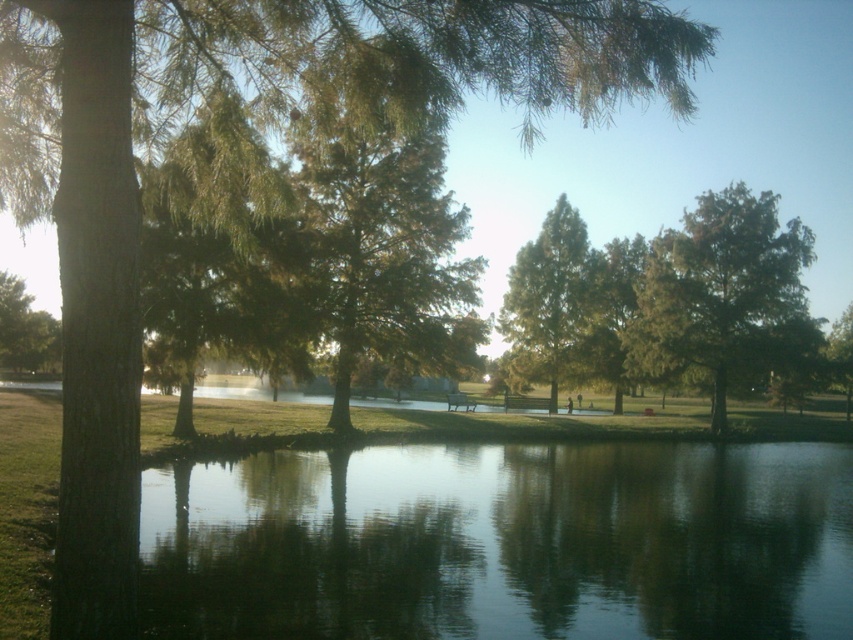
You are a photographer setting up a wide shot of the park scene. You want to ensure both the green leafy tree at upper right and the green matte tree at center are fully visible in your frame. Which tree requires more horizontal space in your composition?

The green leafy tree at upper right requires more horizontal space in your composition because it might be wider than the green matte tree at center.

You are standing at the camera position in the park scene. You want to walk directly to the green matte tree at center. How many steps would you estimate it would take if each step covers about 3 feet?

The green matte tree at center is 207.82 feet away from the camera. If each step covers about 3 feet, dividing 207.82 by 3 gives approximately 69.27 steps. Therefore, it would take roughly 70 steps to reach the green matte tree at center.

You are standing in the park and want to take a photo of both the green leafy tree at upper right and the green matte tree at center. Which tree should you focus on first if you want to include both in your frame without moving the camera?

You should focus on the green leafy tree at upper right first because it is shorter than the green matte tree at center, allowing you to frame both by adjusting the camera angle to include the taller tree in the background.